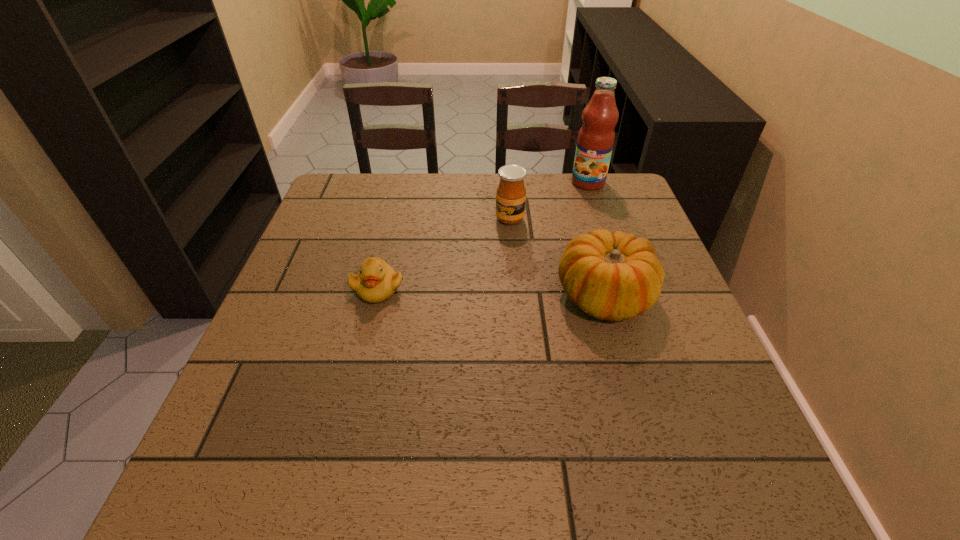
Image resolution: width=960 pixels, height=540 pixels. What are the coordinates of `free space between the leftmost object and the second object from left to right` in the screenshot? It's located at (444, 254).

The image size is (960, 540). In order to click on free area in between the duckling and the honey in this screenshot , I will do `click(444, 254)`.

At what (x,y) coordinates should I click in order to perform the action: click on free space between the honey and the gourd. Please return your answer as a coordinate pair (x, y). Looking at the image, I should click on (557, 258).

Where is `free space between the second object from left to right and the duckling`? free space between the second object from left to right and the duckling is located at coordinates (444, 254).

You are a GUI agent. You are given a task and a screenshot of the screen. Output one action in this format:
    pyautogui.click(x=<x>, y=<y>)
    Task: Click on the vacant region between the second farthest object and the leftmost object
    The height and width of the screenshot is (540, 960).
    Given the screenshot: What is the action you would take?
    pyautogui.click(x=444, y=254)

Identify the location of vacant space that's between the second farthest object and the leftmost object. The width and height of the screenshot is (960, 540). (444, 254).

Identify the location of free space between the fruit juice and the duckling. (483, 235).

Locate an element on the screen. The width and height of the screenshot is (960, 540). object that is the third nearest to the duckling is located at coordinates (596, 137).

This screenshot has height=540, width=960. What are the coordinates of `object that ranks as the closest to the farthest object` in the screenshot? It's located at (511, 193).

Image resolution: width=960 pixels, height=540 pixels. Identify the location of blank area in the image that satisfies the following two spatial constraints: 1. at the beak of the gourd; 2. on the right side of the duckling. (375, 297).